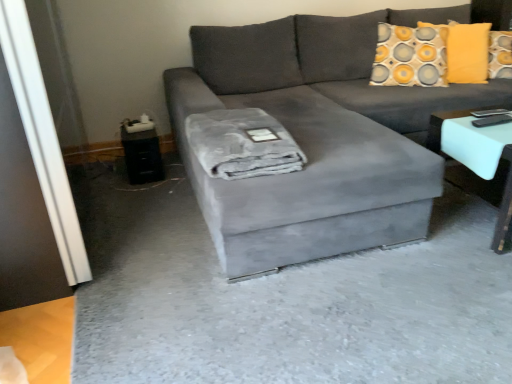
Locate an element on the screen. The width and height of the screenshot is (512, 384). white glossy table at right is located at coordinates (478, 159).

Measure the distance between velvet gray ottoman at center and camera.

A distance of 4.04 feet exists between velvet gray ottoman at center and camera.

Find the location of `white glossy table at right`. white glossy table at right is located at coordinates (478, 159).

Considering their positions, is gray plush blanket at center located in front of or behind black plastic side table at lower left?

Clearly, gray plush blanket at center is in front of black plastic side table at lower left.

Can you confirm if gray plush blanket at center is taller than black plastic side table at lower left?

Incorrect, the height of gray plush blanket at center is not larger of that of black plastic side table at lower left.

Is gray plush blanket at center surrounding black plastic side table at lower left?

No, gray plush blanket at center does not contain black plastic side table at lower left.

Is gray plush blanket at center oriented towards black plastic side table at lower left?

No.

Is velvet gray couch at center positioned in front of black plastic side table at lower left?

Yes, the depth of velvet gray couch at center is less than that of black plastic side table at lower left.

Considering the sizes of objects velvet gray couch at center and black plastic side table at lower left in the image provided, who is taller, velvet gray couch at center or black plastic side table at lower left?

velvet gray couch at center.

Is velvet gray couch at center bigger than black plastic side table at lower left?

Indeed, velvet gray couch at center has a larger size compared to black plastic side table at lower left.

From the picture: From the image's perspective, is transparent glass door at left located beneath white glossy table at right?

Incorrect, from the image's perspective, transparent glass door at left is higher than white glossy table at right.

Can you confirm if transparent glass door at left is positioned to the left of white glossy table at right?

Yes, transparent glass door at left is to the left of white glossy table at right.

Does transparent glass door at left turn towards white glossy table at right?

Yes, transparent glass door at left is oriented towards white glossy table at right.

Would you say velvet gray couch at center is outside transparent glass door at left?

Yes, velvet gray couch at center is not within transparent glass door at left.

Identify the location of glass door lying below the velvet gray couch at center (from the image's perspective). (38, 158).

Looking at this image, is velvet gray couch at center aimed at transparent glass door at left?

No.

The image size is (512, 384). I want to click on glass door in front of the black plastic side table at lower left, so click(38, 158).

Would you say transparent glass door at left is outside black plastic side table at lower left?

Yes, transparent glass door at left is not within black plastic side table at lower left.

Between transparent glass door at left and black plastic side table at lower left, which one has smaller size?

black plastic side table at lower left is smaller.

Between velvet gray couch at center and white glossy table at right, which one has smaller width?

white glossy table at right is thinner.

Which object is positioned more to the left, velvet gray couch at center or white glossy table at right?

Positioned to the left is velvet gray couch at center.

Where is `table below the velvet gray couch at center (from the image's perspective)`? table below the velvet gray couch at center (from the image's perspective) is located at coordinates (478, 159).

From the image's perspective, is velvet gray couch at center on white glossy table at right?

Yes.

Which object is closer to the camera taking this photo, velvet gray ottoman at center or velvet gray couch at center?

Positioned in front is velvet gray ottoman at center.

Does point (322, 353) lie in front of point (440, 195)?

Yes, point (322, 353) is in front of point (440, 195).

What are the coordinates of `studio couch positioned vertically above the velvet gray ottoman at center (from a real-world perspective)` in the screenshot? It's located at (318, 137).

What's the angular difference between velvet gray ottoman at center and velvet gray couch at center's facing directions?

90.7 degrees separate the facing orientations of velvet gray ottoman at center and velvet gray couch at center.

You are a GUI agent. You are given a task and a screenshot of the screen. Output one action in this format:
    pyautogui.click(x=<x>, y=<y>)
    Task: Click on the material above the black plastic side table at lower left (from a real-world perspective)
    The width and height of the screenshot is (512, 384).
    Given the screenshot: What is the action you would take?
    (x=242, y=144)

This screenshot has width=512, height=384. I want to click on studio couch lying in front of the black plastic side table at lower left, so click(x=318, y=137).

Based on the photo, from the image, which object appears to be nearer to velvet gray couch at center, black plastic side table at lower left or transparent glass door at left?

black plastic side table at lower left lies closer to velvet gray couch at center than the other object.

Which object lies further to the anchor point black plastic side table at lower left, velvet gray couch at center or white glossy table at right?

The object further to black plastic side table at lower left is white glossy table at right.

Looking at this image, estimate the real-world distances between objects in this image. Which object is further from velvet gray ottoman at center, transparent glass door at left or black plastic side table at lower left?

Based on the image, transparent glass door at left appears to be further to velvet gray ottoman at center.

Looking at the image, which one is located closer to transparent glass door at left, velvet gray couch at center or velvet gray ottoman at center?

Among the two, velvet gray ottoman at center is located nearer to transparent glass door at left.

Based on the photo, considering their positions, is black plastic side table at lower left positioned closer to velvet gray ottoman at center than white glossy table at right?

white glossy table at right is closer to velvet gray ottoman at center.

When comparing their distances from black plastic side table at lower left, does gray plush blanket at center or white glossy table at right seem further?

white glossy table at right is further to black plastic side table at lower left.

Considering their positions, is velvet gray ottoman at center positioned further to gray plush blanket at center than white glossy table at right?

Based on the image, white glossy table at right appears to be further to gray plush blanket at center.

Considering their positions, is velvet gray ottoman at center positioned further to black plastic side table at lower left than velvet gray couch at center?

velvet gray ottoman at center is further to black plastic side table at lower left.

The image size is (512, 384). What are the coordinates of `concrete between transparent glass door at left and white glossy table at right in the horizontal direction` in the screenshot? It's located at (285, 300).

Where is `material between transparent glass door at left and velvet gray couch at center`? Image resolution: width=512 pixels, height=384 pixels. material between transparent glass door at left and velvet gray couch at center is located at coordinates (242, 144).

Image resolution: width=512 pixels, height=384 pixels. I want to click on studio couch between velvet gray ottoman at center and white glossy table at right in the horizontal direction, so [318, 137].

Find the location of a particular element. The image size is (512, 384). material between black plastic side table at lower left and velvet gray couch at center is located at coordinates [242, 144].